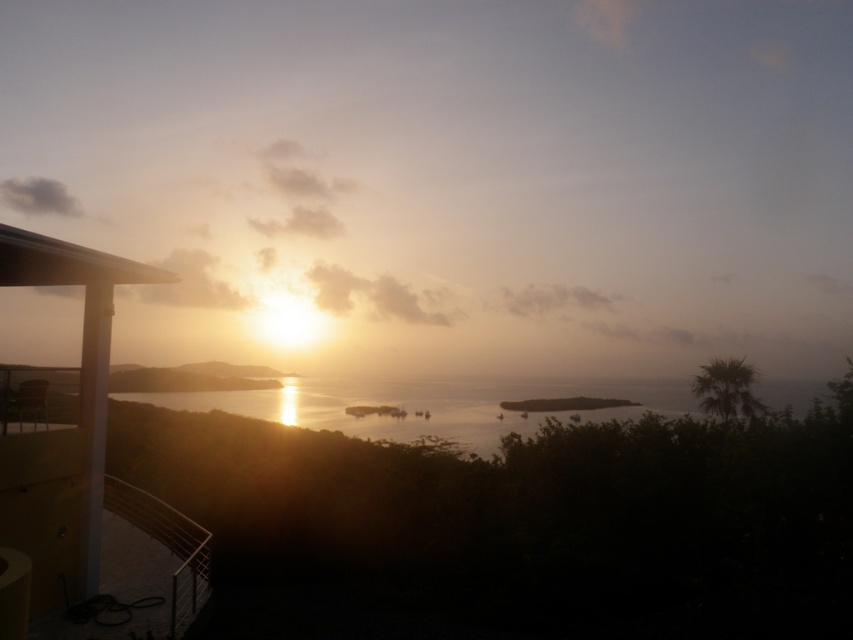
You are standing on the balcony and want to place a small potted plant. The recommended placement is at the point with coordinates point (x=67, y=433). Based on the scene description, where exactly is this point located?

The point (x=67, y=433) corresponds to the matte yellow balcony at left, so the potted plant should be placed there.

You are standing on the balcony and want to look down at the water. Is the matte yellow balcony at left higher than the silvery reflective water at center?

Yes, the matte yellow balcony at left is above the silvery reflective water at center, so it is higher.

You are standing on the balcony and want to take a photo of the water. Which object, the matte yellow balcony at left or the silvery reflective water at center, will appear larger in your camera view?

The matte yellow balcony at left is much taller than the silvery reflective water at center, so it will appear larger in the camera view.